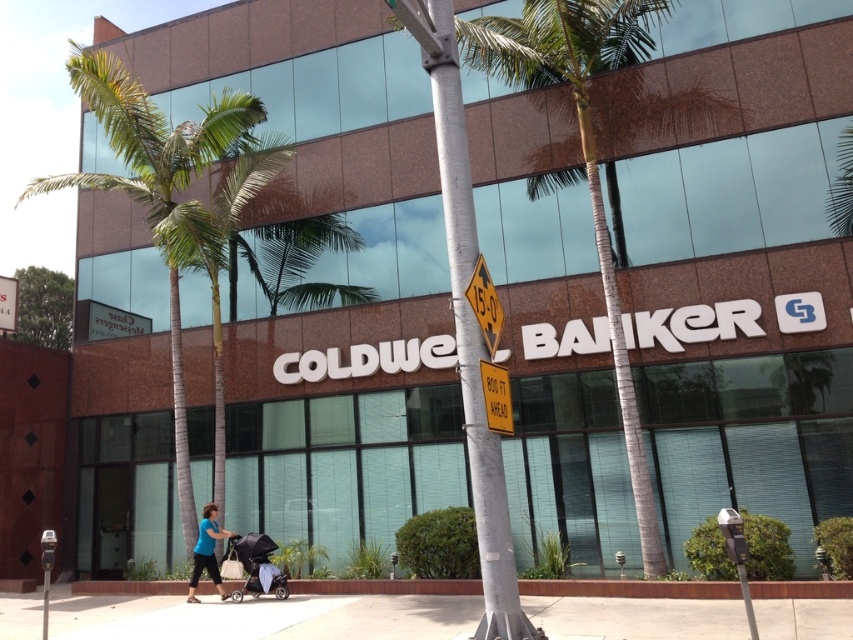
Question: Which point is farther from the camera taking this photo?

Choices:
 (A) (519, 61)
 (B) (456, 147)
 (C) (196, 547)
 (D) (657, 602)

Answer: (A)

Question: Which point is farther to the camera?

Choices:
 (A) (189, 492)
 (B) (50, 604)
 (C) (479, 250)

Answer: (A)

Question: In this image, where is green leafy palm tree at center located relative to blue fabric stroller at lower center?

Choices:
 (A) right
 (B) left

Answer: (A)

Question: Is yellow plastic speed limit sign at center further to the viewer compared to yellow plastic sign at center?

Choices:
 (A) no
 (B) yes

Answer: (B)

Question: Where is concrete at center located in relation to yellow plastic sign at center in the image?

Choices:
 (A) right
 (B) left

Answer: (B)

Question: Estimate the real-world distances between objects in this image. Which object is farther from the concrete at center?

Choices:
 (A) yellow plastic sign at center
 (B) green leafy palm tree at left
 (C) green leafy palm tree at center

Answer: (C)